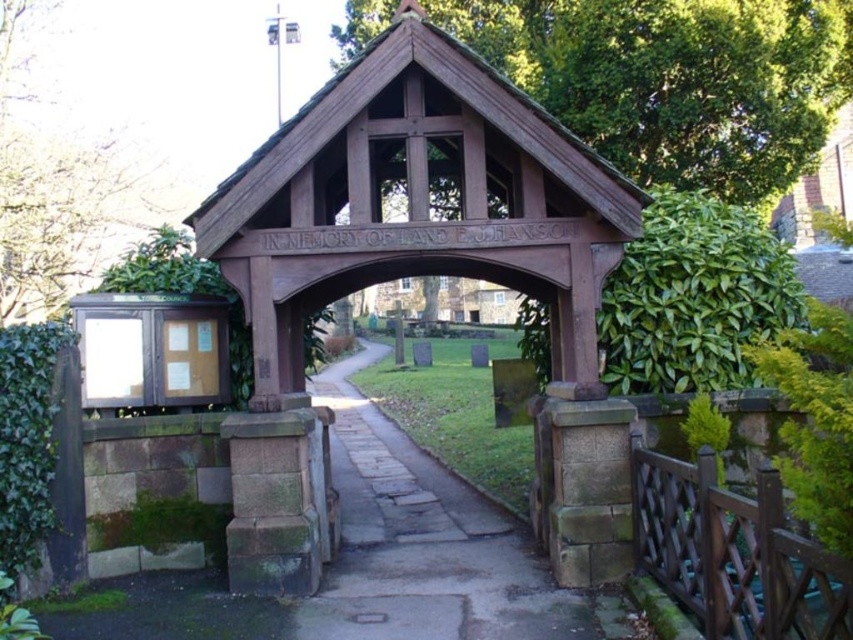
Question: Which object is the farthest from the wooden gazebo at center?

Choices:
 (A) green leafy tree at upper center
 (B) paved stone path at center

Answer: (A)

Question: Which object is the farthest from the green leafy tree at upper left?

Choices:
 (A) wooden gazebo at center
 (B) paved stone path at center
 (C) green leafy tree at upper center

Answer: (C)

Question: Does wooden gazebo at center have a greater width compared to paved stone path at center?

Choices:
 (A) yes
 (B) no

Answer: (B)

Question: Which object appears farthest from the camera in this image?

Choices:
 (A) wooden gazebo at center
 (B) paved stone path at center
 (C) green leafy tree at upper left

Answer: (C)

Question: Does wooden gazebo at center appear under green leafy tree at upper left?

Choices:
 (A) yes
 (B) no

Answer: (A)

Question: Does wooden gazebo at center have a greater width compared to green leafy tree at upper center?

Choices:
 (A) no
 (B) yes

Answer: (B)